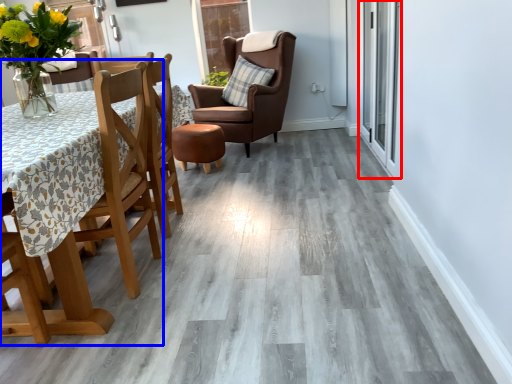
Question: Which of the following is the closest to the observer, glass door (highlighted by a red box) or chair (highlighted by a blue box)?

Choices:
 (A) glass door
 (B) chair

Answer: (B)